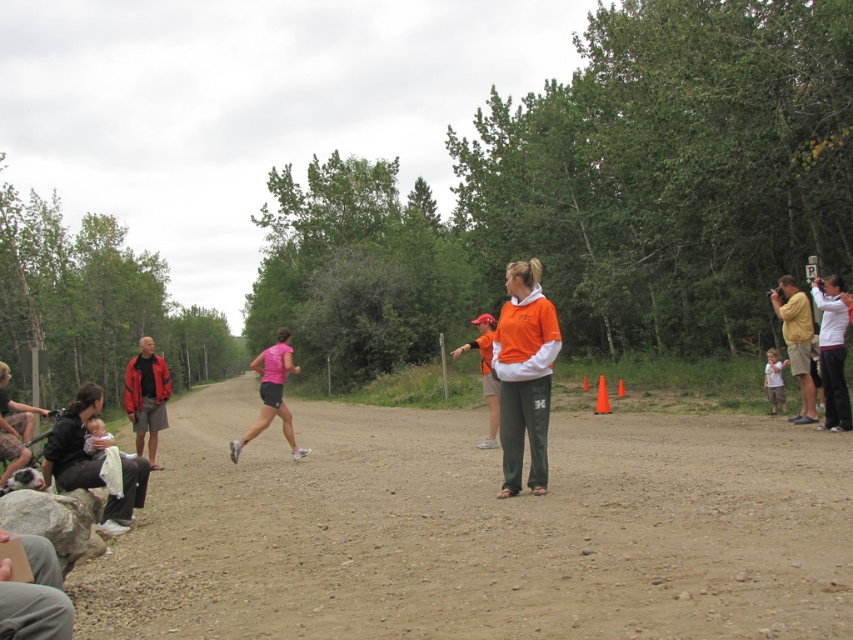
You are a photographer at the running event. You want to take a photo of the runner in a pink top without any obstructions. Are the dark gray fabric baby at left and the matte red jacket at left blocking your view? Explain your reasoning.

The dark gray fabric baby at left is in front of the matte red jacket at left, so the dark gray fabric baby at left would block the view of the runner in a pink top. The matte red jacket at left is behind the dark gray fabric baby at left and thus also partially obstructed.

You are a photographer at the running event. You want to capture a photo that includes both the matte red jacket at left and the orange fabric shirt at center. The camera you are using has a maximum focus range of 15 feet. Can you fit both subjects into the frame without moving your position?

The matte red jacket at left and orange fabric shirt at center are 17.80 feet apart from each other. Since the distance between them exceeds the camera maximum focus range of 15 feet, you cannot fit both subjects into the frame without moving your position.

You are a photographer positioned at the starting line of the running event. You want to capture a photo of the runner in a pink top and the matte red jacket at left. Since you can only focus on one subject clearly, which subject should you focus on to ensure it appears sharp in the photo?

You should focus on the matte red jacket at left because it is closer to you than the runner in a pink top, so focusing on the closer subject will keep it sharp while the background may blur.